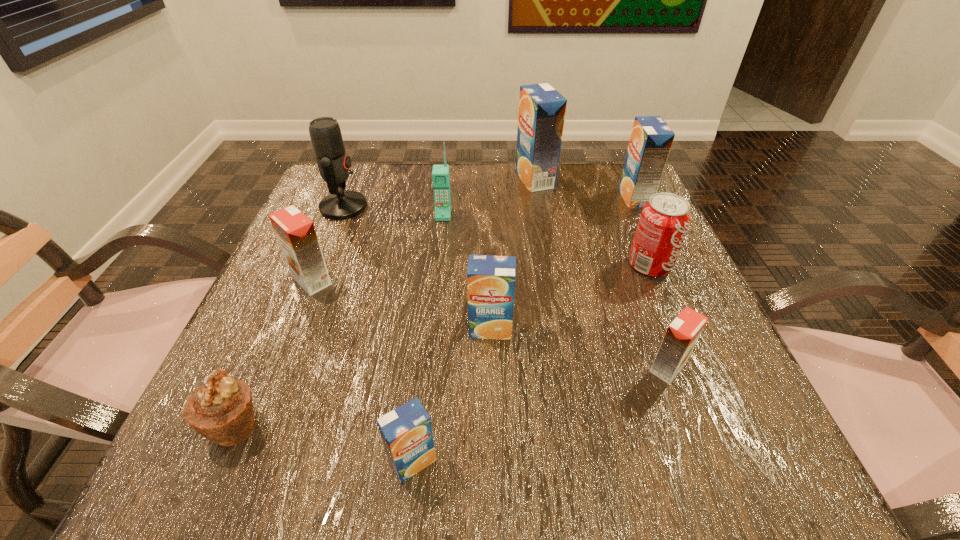
You are a GUI agent. You are given a task and a screenshot of the screen. Output one action in this format:
    pyautogui.click(x=<x>, y=<y>)
    Task: Click on the vacant region between the cellular telephone and the biggest blue orange_juice
    The height and width of the screenshot is (540, 960).
    Given the screenshot: What is the action you would take?
    pyautogui.click(x=489, y=197)

Where is `free space between the third blue orange_juice from left to right and the third nearest object`? free space between the third blue orange_juice from left to right and the third nearest object is located at coordinates (601, 274).

In order to click on blank region between the fourth orange_juice from left to right and the second tallest orange_juice in this screenshot , I will do `click(585, 188)`.

Identify the location of object that is the eighth closest one to the muffin. This screenshot has width=960, height=540. (542, 109).

Identify the location of the fifth closest object relative to the cellular telephone. The width and height of the screenshot is (960, 540). (664, 221).

Locate which orange_juice ranks second in proximity to the left orange orange juice. Please provide its 2D coordinates. Your answer should be formatted as a tuple, i.e. [(x, y)], where the tuple contains the x and y coordinates of a point satisfying the conditions above.

[(406, 431)]

Point out which orange_juice is positioned as the fourth nearest to the leftmost blue orange_juice. Please provide its 2D coordinates. Your answer should be formatted as a tuple, i.e. [(x, y)], where the tuple contains the x and y coordinates of a point satisfying the conditions above.

[(542, 109)]

You are a GUI agent. You are given a task and a screenshot of the screen. Output one action in this format:
    pyautogui.click(x=<x>, y=<y>)
    Task: Click on the closest blue orange_juice to the muffin
    The image size is (960, 540).
    Given the screenshot: What is the action you would take?
    pyautogui.click(x=406, y=431)

Identify the location of the closest blue orange_juice to the eighth farthest object. (490, 279).